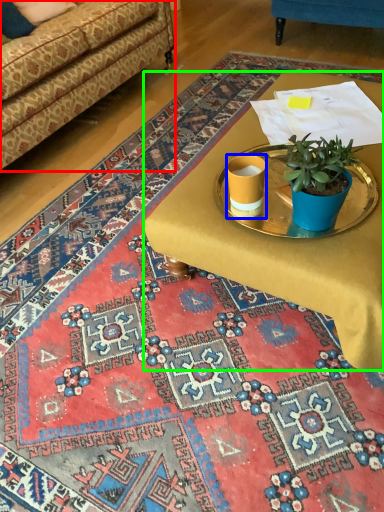
Question: Based on their relative distances, which object is nearer to studio couch (highlighted by a red box)? Choose from coffee cup (highlighted by a blue box) and desk (highlighted by a green box).

Choices:
 (A) coffee cup
 (B) desk

Answer: (B)